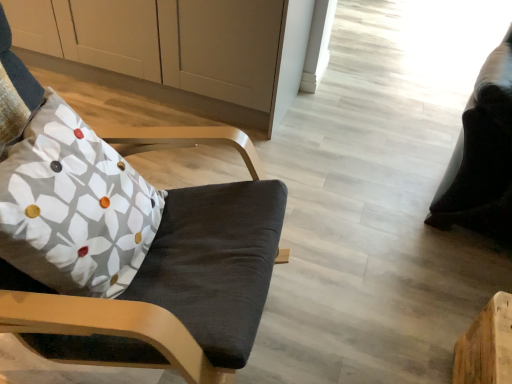
Question: Considering the positions of white matte cabinet at upper left and matte black chair at left in the image, is white matte cabinet at upper left taller or shorter than matte black chair at left?

Choices:
 (A) tall
 (B) short

Answer: (B)

Question: Would you say white matte cabinet at upper left is to the left or to the right of matte black chair at left in the picture?

Choices:
 (A) left
 (B) right

Answer: (A)

Question: Which object is positioned farthest from the white matte cabinet at upper left?

Choices:
 (A) matte black chair at left
 (B) floral fabric pillow at left
 (C) black leather bean bag chair at right

Answer: (C)

Question: Considering the real-world distances, which object is farthest from the floral fabric pillow at left?

Choices:
 (A) black leather bean bag chair at right
 (B) white matte cabinet at upper left
 (C) matte black chair at left

Answer: (A)